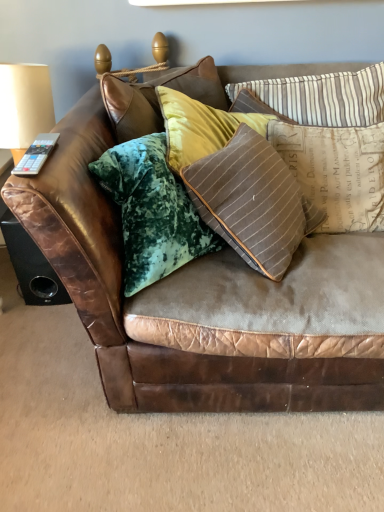
Question: Does point [48, 302] appear closer or farther from the camera than point [150, 380]?

Choices:
 (A) closer
 (B) farther

Answer: (B)

Question: Considering the positions of brown leather speaker at lower left and brown leather couch at center in the image, is brown leather speaker at lower left taller or shorter than brown leather couch at center?

Choices:
 (A) short
 (B) tall

Answer: (A)

Question: Which of these objects is positioned closest to the brown leather speaker at lower left?

Choices:
 (A) striped fabric pillow at upper right, which appears as the second pillow when ordered from the bottom
 (B) matte beige lampshade at upper left
 (C) brown striped pillow at upper right, arranged as the second pillow when viewed from the top
 (D) brown leather couch at center
 (E) gray plastic remote at upper left

Answer: (B)

Question: Which object is positioned closest to the gray plastic remote at upper left?

Choices:
 (A) brown leather speaker at lower left
 (B) brown leather couch at center
 (C) brown striped pillow at upper right, arranged as the second pillow when viewed from the top
 (D) striped fabric pillow at upper right, which appears as the second pillow when ordered from the bottom
 (E) matte beige lampshade at upper left

Answer: (E)